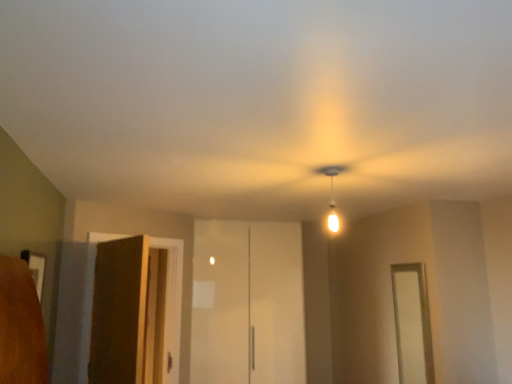
Question: Does brown wood elevator at left, the first elevator viewed from the left, have a lesser width compared to white glossy door at right?

Choices:
 (A) yes
 (B) no

Answer: (B)

Question: From a real-world perspective, is brown wood elevator at left, arranged as the second elevator when viewed from the back, on top of white glossy door at right?

Choices:
 (A) no
 (B) yes

Answer: (B)

Question: Is brown wood elevator at left, the first elevator viewed from the left, at the right side of white glossy door at right?

Choices:
 (A) yes
 (B) no

Answer: (B)

Question: Does brown wood elevator at left, arranged as the second elevator when viewed from the back, lie behind white glossy door at right?

Choices:
 (A) yes
 (B) no

Answer: (B)

Question: Is brown wood elevator at left, the 1th elevator positioned from the front, directly adjacent to white glossy door at right?

Choices:
 (A) yes
 (B) no

Answer: (B)

Question: Considering the positions of white glossy door at right and brown wood elevator at left, arranged as the second elevator when viewed from the back, in the image, is white glossy door at right taller or shorter than brown wood elevator at left, arranged as the second elevator when viewed from the back,?

Choices:
 (A) tall
 (B) short

Answer: (B)

Question: Does point (399, 311) appear closer or farther from the camera than point (89, 266)?

Choices:
 (A) farther
 (B) closer

Answer: (A)

Question: From the image's perspective, is white glossy door at right positioned above or below brown wood elevator at left, the second elevator from the right?

Choices:
 (A) below
 (B) above

Answer: (A)

Question: Relative to brown wood elevator at left, the first elevator viewed from the left, is white glossy door at right in front or behind?

Choices:
 (A) front
 (B) behind

Answer: (B)

Question: Based on their positions, is brown wood elevator at left, the second elevator from the right, located to the left or right of matte white bulb at center?

Choices:
 (A) left
 (B) right

Answer: (A)

Question: Is brown wood elevator at left, arranged as the second elevator when viewed from the back, in front of or behind matte white bulb at center in the image?

Choices:
 (A) behind
 (B) front

Answer: (A)

Question: Based on their sizes in the image, would you say brown wood elevator at left, the first elevator viewed from the left, is bigger or smaller than matte white bulb at center?

Choices:
 (A) big
 (B) small

Answer: (A)

Question: Is point (86, 279) closer or farther from the camera than point (323, 168)?

Choices:
 (A) farther
 (B) closer

Answer: (A)

Question: From the image's perspective, is matte white bulb at center above or below brown wood elevator at left, the first elevator viewed from the left?

Choices:
 (A) below
 (B) above

Answer: (B)

Question: In the image, is matte white bulb at center positioned in front of or behind brown wood elevator at left, the second elevator from the right?

Choices:
 (A) behind
 (B) front

Answer: (B)